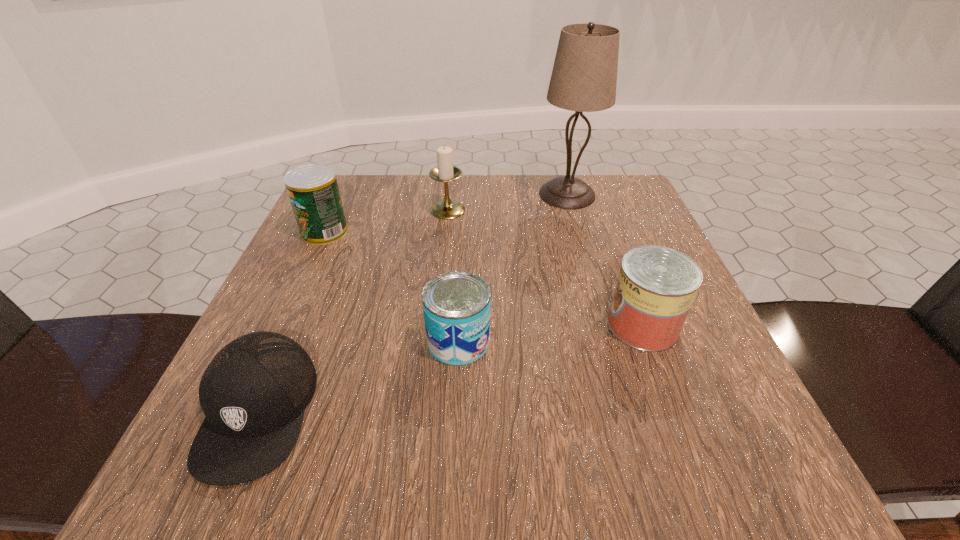
Locate an element on the screen. The image size is (960, 540). lampshade is located at coordinates (584, 77).

Locate an element on the screen. The width and height of the screenshot is (960, 540). candle holder is located at coordinates (445, 172).

The height and width of the screenshot is (540, 960). I want to click on the leftmost can, so click(x=313, y=190).

Find the location of `the rightmost can`. the rightmost can is located at coordinates (656, 286).

The width and height of the screenshot is (960, 540). I want to click on the second can from left to right, so click(x=456, y=305).

Where is `cap`? This screenshot has width=960, height=540. cap is located at coordinates (253, 393).

This screenshot has width=960, height=540. I want to click on free spot located 0.150m on the front-facing side of the tallest object, so click(x=584, y=251).

Locate an element on the screen. vacant space situated on the right of the fifth shortest object is located at coordinates (594, 210).

Where is `free region located on the back of the leftmost can`? free region located on the back of the leftmost can is located at coordinates (337, 205).

Locate an element on the screen. vacant space located 0.330m on the left of the rightmost can is located at coordinates (408, 325).